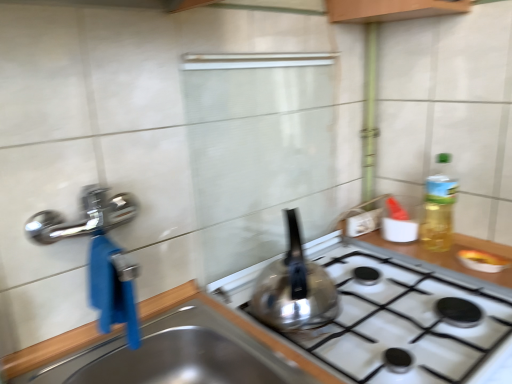
Question: In the image, is satin silver kettle at center on the left side or the right side of stainless steel sink at lower left?

Choices:
 (A) right
 (B) left

Answer: (A)

Question: Is satin silver kettle at center spatially inside stainless steel sink at lower left, or outside of it?

Choices:
 (A) outside
 (B) inside

Answer: (A)

Question: From the image's perspective, is satin silver kettle at center positioned above or below stainless steel sink at lower left?

Choices:
 (A) above
 (B) below

Answer: (A)

Question: From their relative heights in the image, would you say stainless steel sink at lower left is taller or shorter than satin silver kettle at center?

Choices:
 (A) short
 (B) tall

Answer: (A)

Question: Looking at the image, does stainless steel sink at lower left seem bigger or smaller compared to satin silver kettle at center?

Choices:
 (A) big
 (B) small

Answer: (A)

Question: In terms of width, does stainless steel sink at lower left look wider or thinner when compared to satin silver kettle at center?

Choices:
 (A) thin
 (B) wide

Answer: (B)

Question: From a real-world perspective, is stainless steel sink at lower left above or below satin silver kettle at center?

Choices:
 (A) below
 (B) above

Answer: (A)